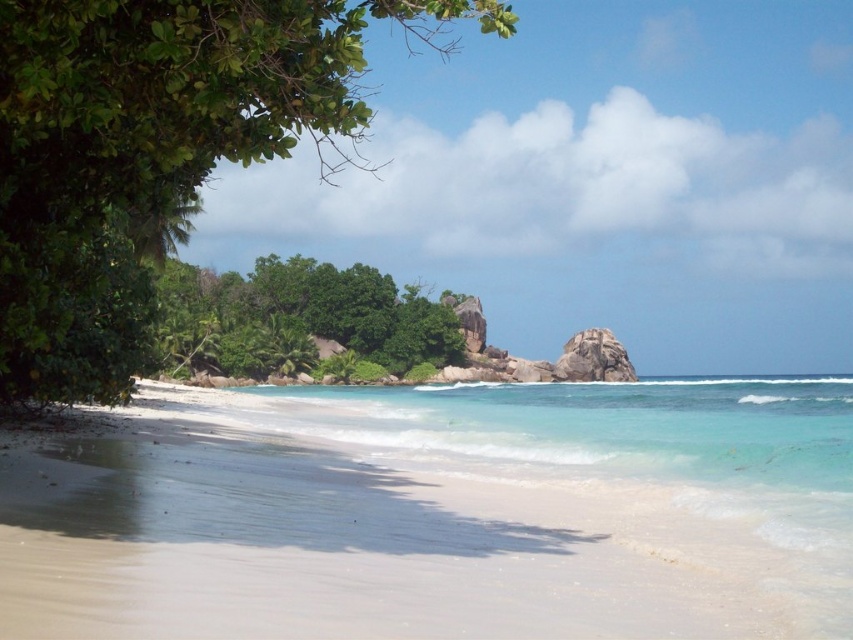
You are planning to set up a small tent on the beach. You need to choose between placing it under the green leafy tree at upper left or near the smooth granite rock at center. Which location would provide more shade due to the object size?

The green leafy tree at upper left is bigger than the smooth granite rock at center, so placing the tent under the green leafy tree at upper left would provide more shade because of its larger size.